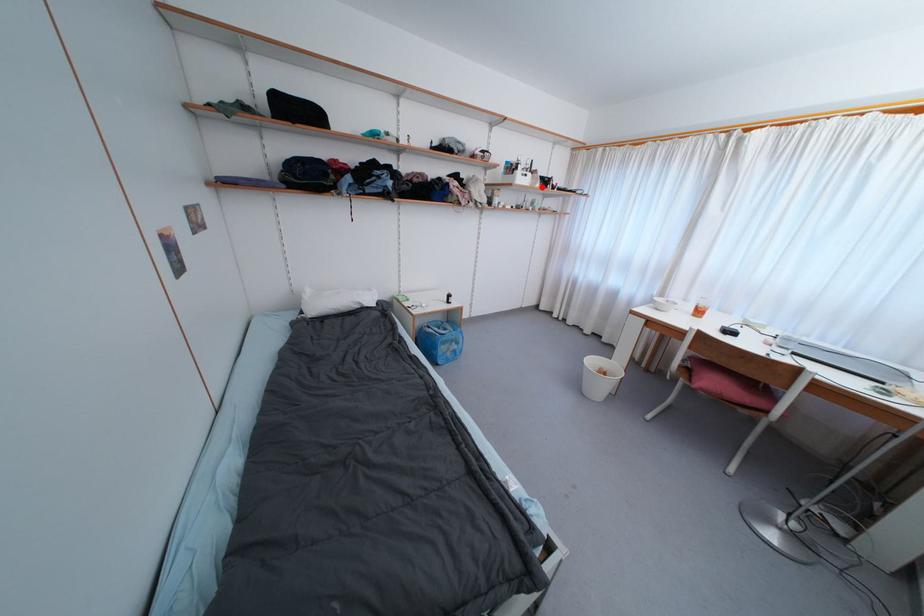
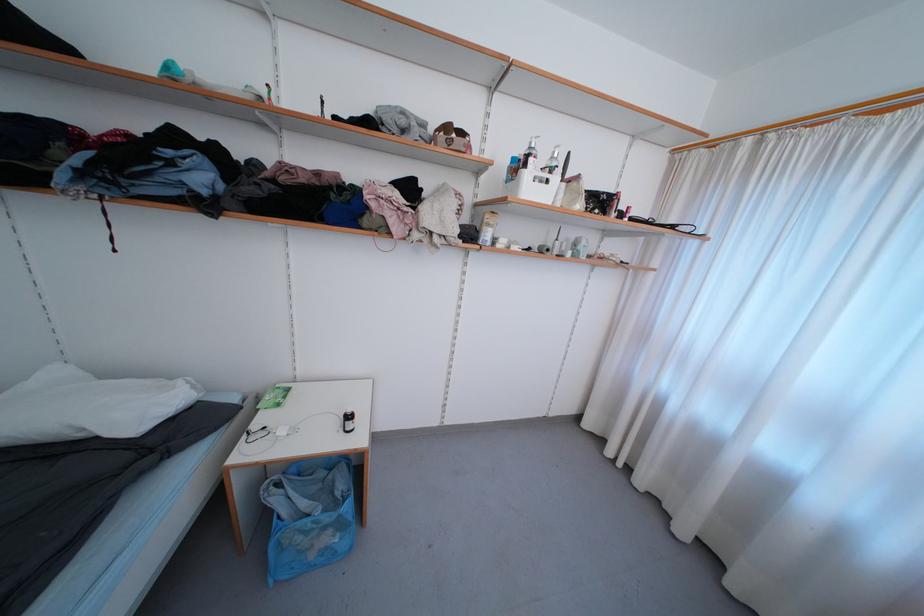
The point at the highlighted location is marked in the first image. Where is the corresponding point in the second image?

(584, 208)